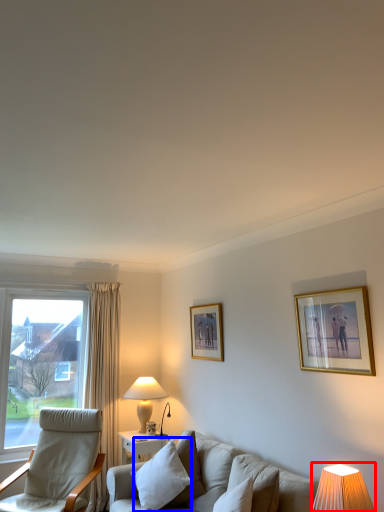
Question: Which of the following is the closest to the observer, table lamp (highlighted by a red box) or pillow (highlighted by a blue box)?

Choices:
 (A) table lamp
 (B) pillow

Answer: (A)